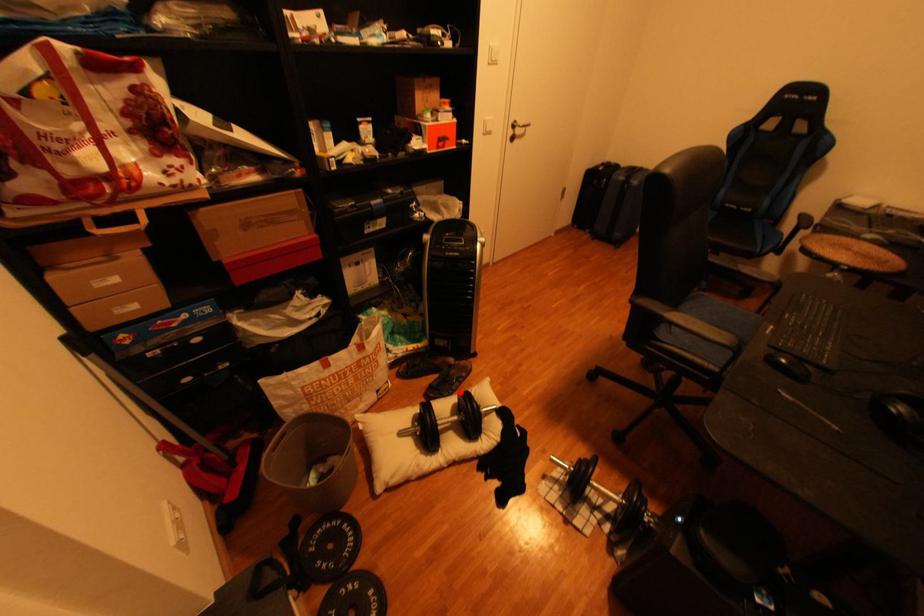
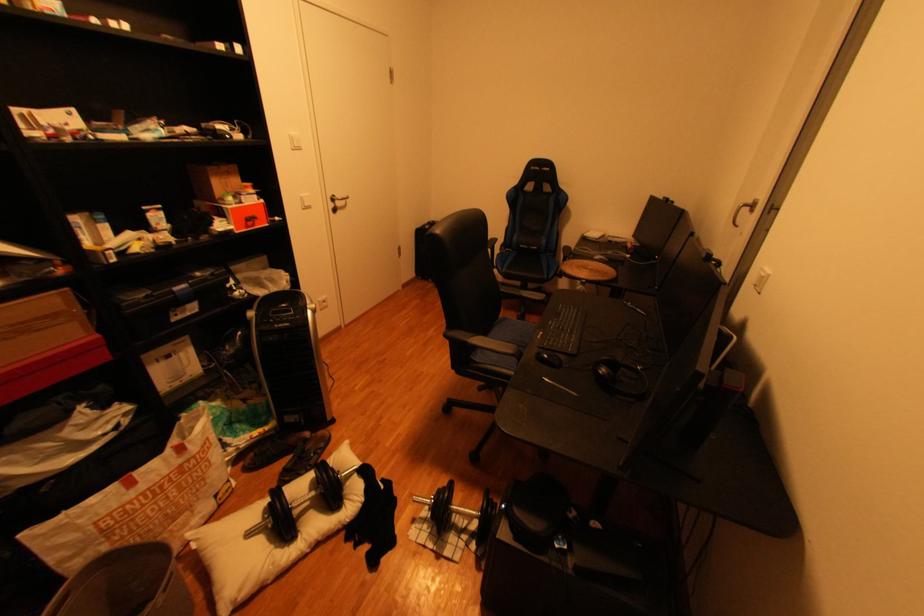
Find the pixel in the second image that matches the highlighted location in the first image.

(318, 468)